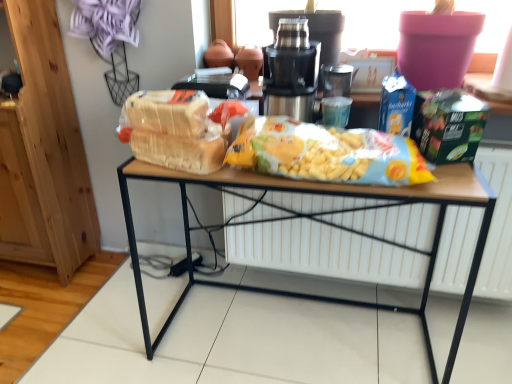
Question: Are metallic stainless steel juicer at center and white matte radiator at center located far from each other?

Choices:
 (A) yes
 (B) no

Answer: (B)

Question: Can white matte radiator at center be found inside metallic stainless steel juicer at center?

Choices:
 (A) no
 (B) yes

Answer: (A)

Question: Can you confirm if metallic stainless steel juicer at center is thinner than white matte radiator at center?

Choices:
 (A) no
 (B) yes

Answer: (A)

Question: Is white matte radiator at center at the back of metallic stainless steel juicer at center?

Choices:
 (A) yes
 (B) no

Answer: (B)

Question: From a real-world perspective, is metallic stainless steel juicer at center physically below white matte radiator at center?

Choices:
 (A) no
 (B) yes

Answer: (A)

Question: Is light brown bread at center to the left or to the right of white matte radiator at center in the image?

Choices:
 (A) left
 (B) right

Answer: (A)

Question: Looking at the image, does light brown bread at center seem bigger or smaller compared to white matte radiator at center?

Choices:
 (A) big
 (B) small

Answer: (B)

Question: From their relative heights in the image, would you say light brown bread at center is taller or shorter than white matte radiator at center?

Choices:
 (A) short
 (B) tall

Answer: (A)

Question: Considering the positions of light brown bread at center and white matte radiator at center in the image, is light brown bread at center wider or thinner than white matte radiator at center?

Choices:
 (A) thin
 (B) wide

Answer: (B)

Question: Is metallic stainless steel juicer at center to the left or to the right of white matte radiator at center in the image?

Choices:
 (A) right
 (B) left

Answer: (B)

Question: Does point (287, 34) appear closer or farther from the camera than point (369, 258)?

Choices:
 (A) closer
 (B) farther

Answer: (A)

Question: From a real-world perspective, is metallic stainless steel juicer at center above or below white matte radiator at center?

Choices:
 (A) above
 (B) below

Answer: (A)

Question: Considering the positions of metallic stainless steel juicer at center and white matte radiator at center in the image, is metallic stainless steel juicer at center wider or thinner than white matte radiator at center?

Choices:
 (A) wide
 (B) thin

Answer: (A)

Question: From the image's perspective, is yellow matte cereal at center located above or below light brown bread at center?

Choices:
 (A) above
 (B) below

Answer: (B)

Question: From a real-world perspective, is yellow matte cereal at center positioned above or below light brown bread at center?

Choices:
 (A) below
 (B) above

Answer: (B)